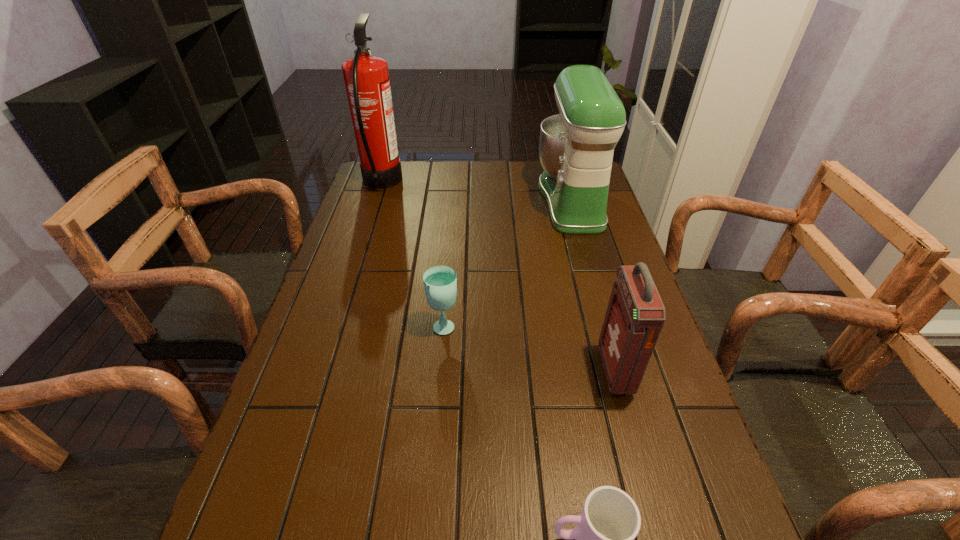
Where is `the tallest object`? This screenshot has width=960, height=540. the tallest object is located at coordinates (366, 77).

In order to click on fire extinguisher in this screenshot , I will do `click(366, 77)`.

You are a GUI agent. You are given a task and a screenshot of the screen. Output one action in this format:
    pyautogui.click(x=<x>, y=<y>)
    Task: Click on the second tallest object
    The image size is (960, 540).
    Given the screenshot: What is the action you would take?
    pyautogui.click(x=576, y=147)

Identify the location of the fourth farthest object. (635, 315).

I want to click on the first-aid kit, so click(x=635, y=315).

The width and height of the screenshot is (960, 540). Find the location of `the fourth object from right to left`. the fourth object from right to left is located at coordinates (440, 282).

Locate an element on the screen. Image resolution: width=960 pixels, height=540 pixels. the second shortest object is located at coordinates (440, 282).

At what (x,y) coordinates should I click in order to perform the action: click on free space located on the front-facing side of the leftmost object. Please return your answer as a coordinate pair (x, y). This screenshot has width=960, height=540. Looking at the image, I should click on (449, 183).

The width and height of the screenshot is (960, 540). Identify the location of vacant space located on the controls of the second tallest object. (429, 200).

Find the location of `vacant space situated on the controls of the second tallest object`. vacant space situated on the controls of the second tallest object is located at coordinates (500, 200).